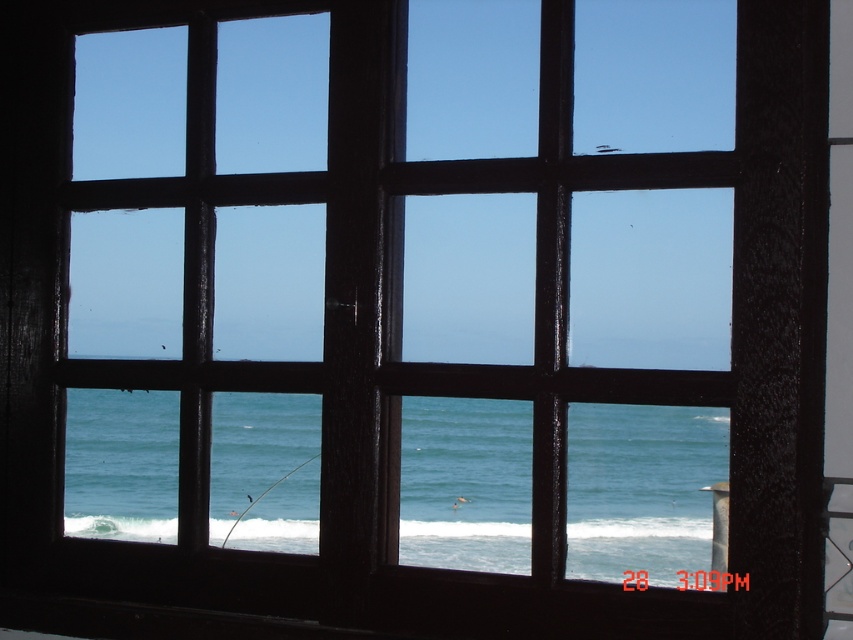
You are a photographer holding a camera that is 1.5 inches wide. You want to capture both the blue water at center and the white frothy wave at lower center in a single shot without moving the camera. Can you fit both objects in your frame?

The blue water at center and the white frothy wave at lower center are 2.05 inches apart. Since the distance between them is greater than the camera width of 1.5 inches, you can fit both objects in your frame without moving the camera.

You are standing at the window and notice the blue water at center and the white frothy wave at lower center. Which one appears higher in the image?

The blue water at center appears higher in the image because it is much taller than the white frothy wave at lower center.

You are standing in front of the window and want to point out the blue water at center to a friend. Where exactly should you direct their attention based on the window grid?

The blue water at center is located at point 0.764 on the horizontal axis and 0.753 on the vertical axis within the window grid structure.